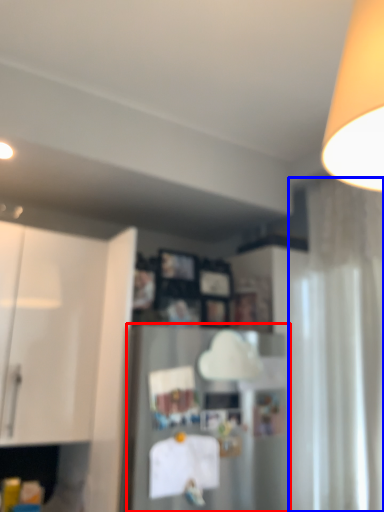
Question: Among these objects, which one is farthest to the camera, appliance (highlighted by a red box) or curtain (highlighted by a blue box)?

Choices:
 (A) appliance
 (B) curtain

Answer: (B)